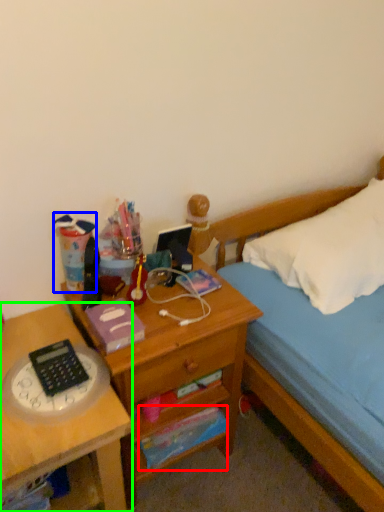
Question: Which object is the farthest from paperback book (highlighted by a red box)? Choose among these: stationery (highlighted by a blue box) or desk (highlighted by a green box).

Choices:
 (A) stationery
 (B) desk

Answer: (A)